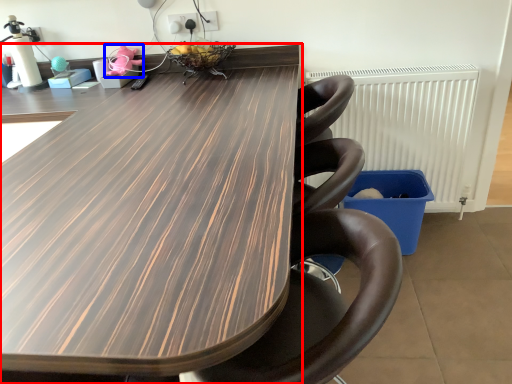
Question: Which object is closer to the camera taking this photo, table (highlighted by a red box) or toy (highlighted by a blue box)?

Choices:
 (A) table
 (B) toy

Answer: (A)